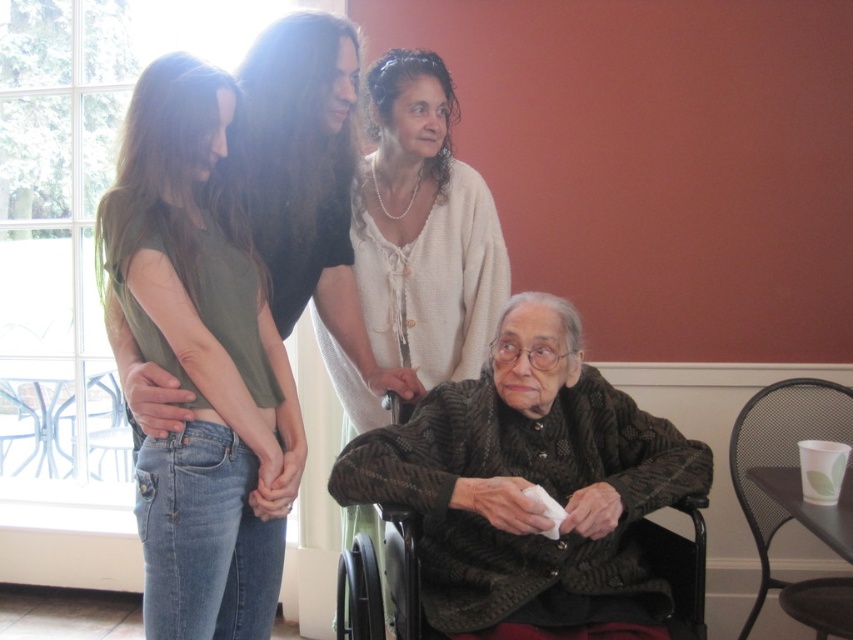
Which is below, white lace blouse at center or black mesh chair at lower right?

black mesh chair at lower right is below.

Does white lace blouse at center have a greater width compared to black mesh chair at lower right?

Correct, the width of white lace blouse at center exceeds that of black mesh chair at lower right.

Who is more forward, (497, 253) or (770, 516)?

Point (497, 253) is in front.

The image size is (853, 640). Find the location of `white lace blouse at center`. white lace blouse at center is located at coordinates (422, 228).

The height and width of the screenshot is (640, 853). What do you see at coordinates (201, 358) in the screenshot?
I see `green cotton shirt at left` at bounding box center [201, 358].

Which is behind, point (247, 349) or point (769, 435)?

The point (769, 435) is behind.

Between point (206, 612) and point (751, 460), which one is positioned behind?

The point (751, 460) is more distant.

This screenshot has height=640, width=853. In order to click on green cotton shirt at left in this screenshot , I will do `click(201, 358)`.

Image resolution: width=853 pixels, height=640 pixels. I want to click on white lace blouse at center, so click(x=422, y=228).

Is white lace blouse at center below dark gray fabric wheelchair at lower center?

No.

What do you see at coordinates (422, 228) in the screenshot?
I see `white lace blouse at center` at bounding box center [422, 228].

This screenshot has width=853, height=640. Identify the location of white lace blouse at center. (422, 228).